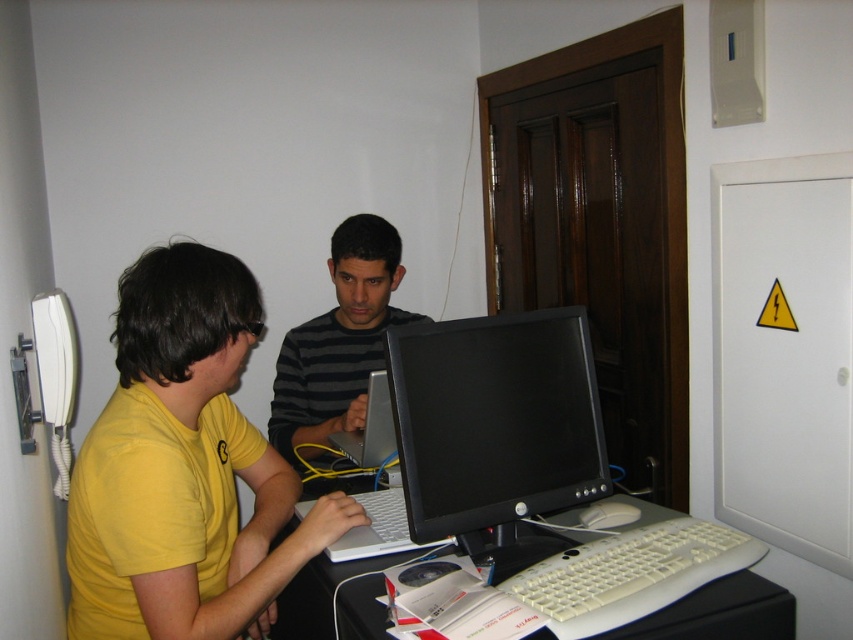
Question: Which point is farther to the camera?

Choices:
 (A) white plastic computer desk at center
 (B) black glossy monitor at center
 (C) yellow matte shirt at left

Answer: (A)

Question: Based on their relative distances, which object is farther from the white plastic keyboard at lower center?

Choices:
 (A) striped sweater at center
 (B) white plastic computer desk at center
 (C) yellow matte shirt at left
 (D) black glossy monitor at center

Answer: (A)

Question: Which point is closer to the camera?

Choices:
 (A) (384, 237)
 (B) (326, 572)
 (C) (624, 611)

Answer: (C)

Question: Does yellow matte shirt at left have a larger size compared to white plastic keyboard at lower center?

Choices:
 (A) yes
 (B) no

Answer: (A)

Question: Is black glossy monitor at center positioned behind striped sweater at center?

Choices:
 (A) no
 (B) yes

Answer: (A)

Question: Is yellow matte shirt at left behind striped sweater at center?

Choices:
 (A) yes
 (B) no

Answer: (B)